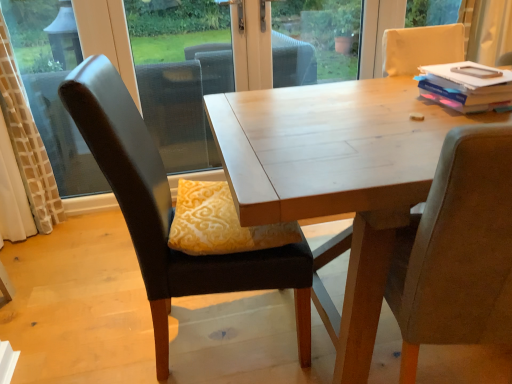
Question: Does matte gray chair at right, which is the second chair in left-to-right order, turn towards hardcover book at upper right?

Choices:
 (A) no
 (B) yes

Answer: (B)

Question: From the image's perspective, is matte gray chair at right, which is the second chair in left-to-right order, below hardcover book at upper right?

Choices:
 (A) no
 (B) yes

Answer: (B)

Question: From a real-world perspective, is matte gray chair at right, which is the 1th chair in right-to-left order, positioned over hardcover book at upper right based on gravity?

Choices:
 (A) yes
 (B) no

Answer: (B)

Question: Considering the relative positions of matte gray chair at right, which is the 1th chair in right-to-left order, and hardcover book at upper right in the image provided, is matte gray chair at right, which is the 1th chair in right-to-left order, to the left of hardcover book at upper right from the viewer's perspective?

Choices:
 (A) yes
 (B) no

Answer: (A)

Question: Is matte gray chair at right, which is the 1th chair in right-to-left order, further to the viewer compared to hardcover book at upper right?

Choices:
 (A) yes
 (B) no

Answer: (B)

Question: From a real-world perspective, is matte gray chair at right, which is the 1th chair in right-to-left order, beneath hardcover book at upper right?

Choices:
 (A) yes
 (B) no

Answer: (A)

Question: Can you confirm if matte gray chair at right, which is the second chair in left-to-right order, is positioned to the right of matte black chair at left, the second chair when ordered from right to left?

Choices:
 (A) no
 (B) yes

Answer: (B)

Question: Does matte gray chair at right, which is the 1th chair in right-to-left order, have a greater width compared to matte black chair at left, the second chair when ordered from right to left?

Choices:
 (A) no
 (B) yes

Answer: (A)

Question: Can you confirm if matte gray chair at right, which is the 1th chair in right-to-left order, is smaller than matte black chair at left, the first chair from the left?

Choices:
 (A) yes
 (B) no

Answer: (A)

Question: From the image's perspective, would you say matte gray chair at right, which is the second chair in left-to-right order, is shown under matte black chair at left, the first chair from the left?

Choices:
 (A) no
 (B) yes

Answer: (B)

Question: Considering the relative sizes of matte gray chair at right, which is the 1th chair in right-to-left order, and matte black chair at left, the first chair from the left, in the image provided, is matte gray chair at right, which is the 1th chair in right-to-left order, shorter than matte black chair at left, the first chair from the left,?

Choices:
 (A) yes
 (B) no

Answer: (A)

Question: Is matte gray chair at right, which is the 1th chair in right-to-left order, not within matte black chair at left, the second chair when ordered from right to left?

Choices:
 (A) no
 (B) yes

Answer: (B)

Question: From a real-world perspective, is hardcover book at upper right located beneath matte black chair at left, the second chair when ordered from right to left?

Choices:
 (A) no
 (B) yes

Answer: (A)